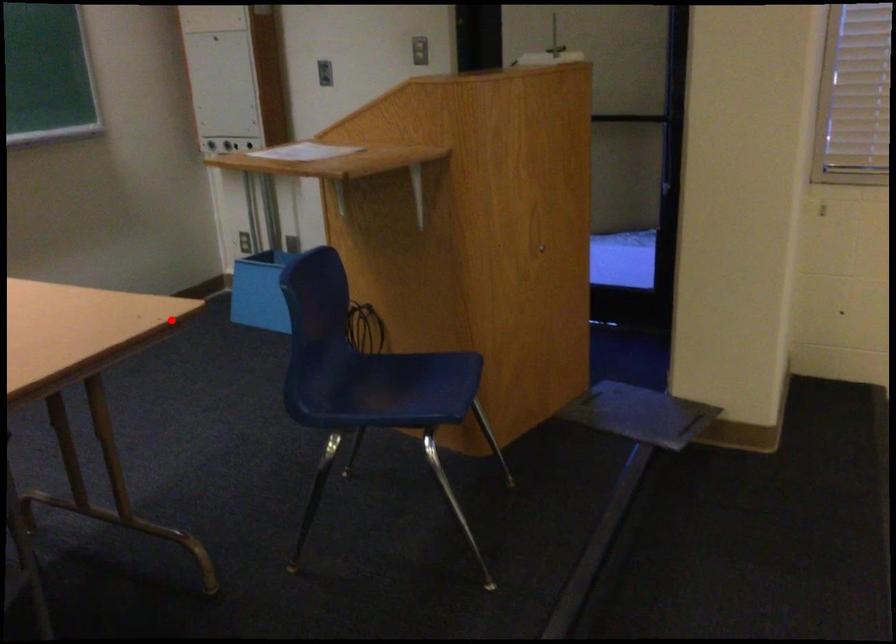
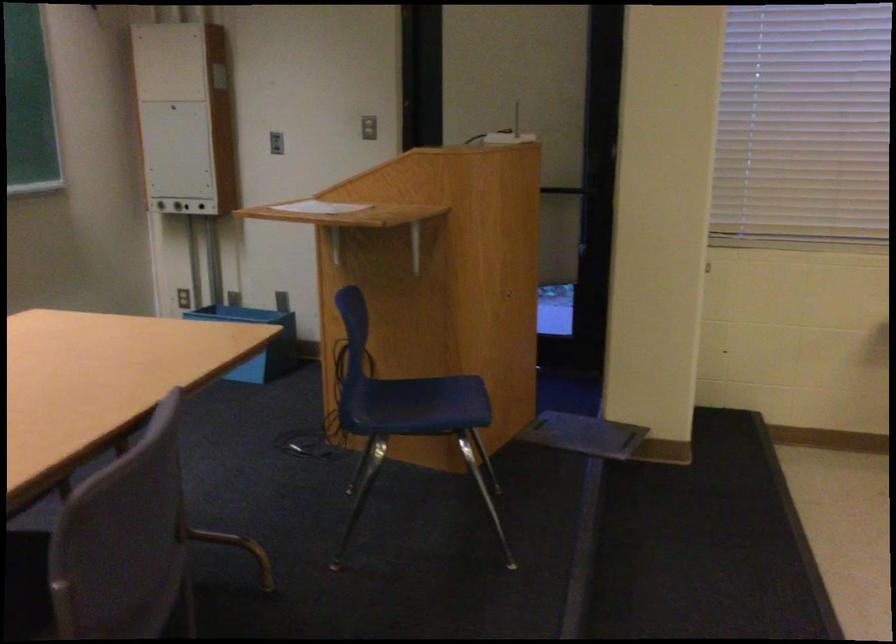
Question: I am providing you with two images of the same scene from different viewpoints. Image1 has a red point marked. In image2, the corresponding 3D location appears at what relative position? Reply with the corresponding letter.

Choices:
 (A) Closer
 (B) Farther

Answer: (B)